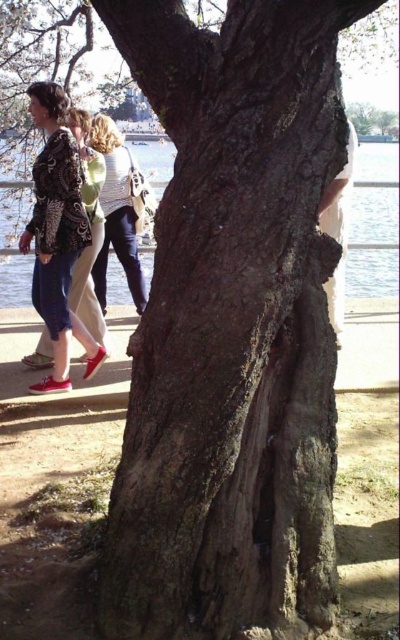
You are an artist planning to draw the scene. You need to decide whether to use a thicker brush for the rough bark tree trunk at center or the matte white sweater at upper left. Which object should you use the thicker brush for?

The rough bark tree trunk at center might be wider than the matte white sweater at upper left, so you should use the thicker brush for the rough bark tree trunk at center to capture its width and texture effectively.

You are an observer standing in front of the tree trunk. You notice the clear water at center and the matte white sweater at upper left. Which object takes up more space in the image?

The clear water at center takes up more space in the image because it is bigger than the matte white sweater at upper left.